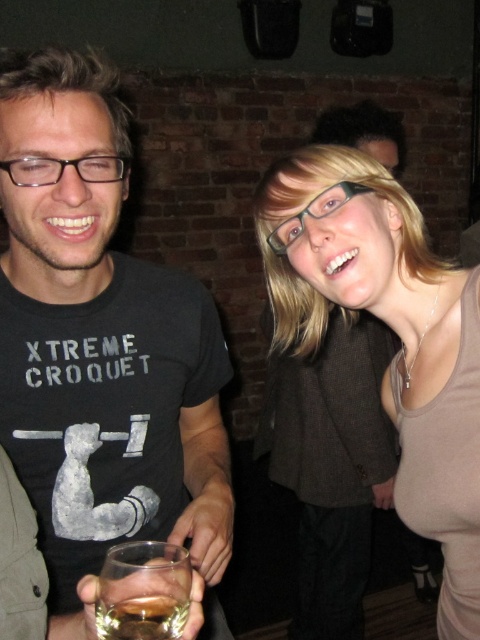
Question: Where is matte brown tank top at center located in relation to clear glass at lower center in the image?

Choices:
 (A) below
 (B) above

Answer: (B)

Question: Is gray cotton t-shirt at center to the left of matte brown tank top at center from the viewer's perspective?

Choices:
 (A) yes
 (B) no

Answer: (A)

Question: Estimate the real-world distances between objects in this image. Which object is closer to the gray cotton t-shirt at center?

Choices:
 (A) matte brown tank top at center
 (B) amber liquid glass at lower left
 (C) clear glass at lower center

Answer: (A)

Question: Based on their relative distances, which object is farther from the amber liquid glass at lower left?

Choices:
 (A) gray cotton t-shirt at center
 (B) matte brown tank top at center
 (C) clear glass at lower center

Answer: (B)

Question: Estimate the real-world distances between objects in this image. Which object is farther from the matte brown tank top at center?

Choices:
 (A) amber liquid glass at lower left
 (B) clear glass at lower center
 (C) gray cotton t-shirt at center

Answer: (A)

Question: Does gray cotton t-shirt at center lie in front of amber liquid glass at lower left?

Choices:
 (A) no
 (B) yes

Answer: (A)